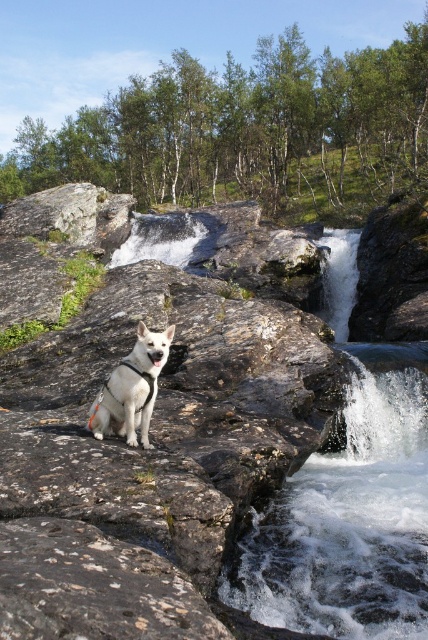
Question: Among these objects, which one is nearest to the camera?

Choices:
 (A) white matte dog at center
 (B) white stone creek at center

Answer: (B)

Question: Among these points, which one is farthest from the camera?

Choices:
 (A) (311, 602)
 (B) (104, 627)
 (C) (103, 408)

Answer: (C)

Question: Among these objects, which one is farthest from the camera?

Choices:
 (A) white matte dog at center
 (B) white stone creek at center

Answer: (A)

Question: Is white stone creek at center to the right of white frothy water at lower right from the viewer's perspective?

Choices:
 (A) yes
 (B) no

Answer: (B)

Question: In this image, where is white stone creek at center located relative to white frothy water at lower right?

Choices:
 (A) above
 (B) below

Answer: (A)

Question: Does white stone creek at center appear under white matte dog at center?

Choices:
 (A) no
 (B) yes

Answer: (A)